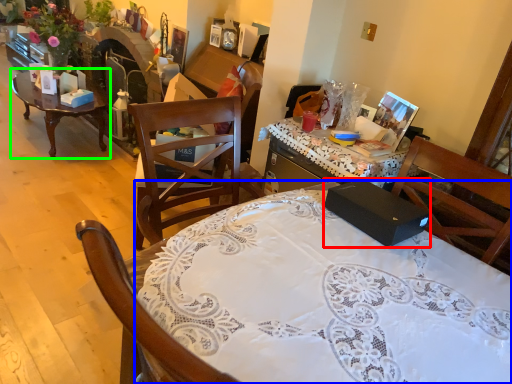
Question: Which object is the closest to the box (highlighted by a red box)? Choose among these: desk (highlighted by a blue box) or coffee table (highlighted by a green box).

Choices:
 (A) desk
 (B) coffee table

Answer: (A)